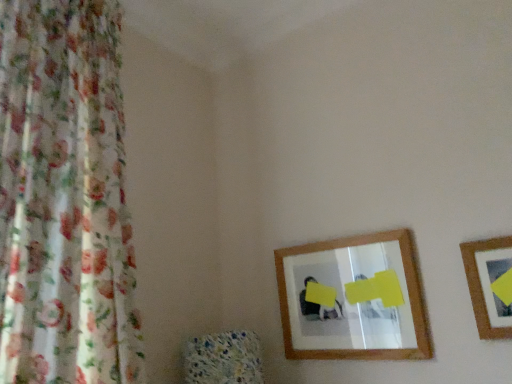
Locate an element on the screen. This screenshot has width=512, height=384. wooden-framed mirror at center is located at coordinates (347, 300).

Where is `picture frame above the wooden-framed mirror at center (from the image's perspective)`? picture frame above the wooden-framed mirror at center (from the image's perspective) is located at coordinates [490, 285].

Between wooden picture frame at right and wooden-framed mirror at center, which one has less height?

wooden picture frame at right is shorter.

Considering the sizes of objects wooden picture frame at right and wooden-framed mirror at center in the image provided, who is bigger, wooden picture frame at right or wooden-framed mirror at center?

With larger size is wooden-framed mirror at center.

Would you say wooden-framed mirror at center is part of floral fabric curtain at left's contents?

No, wooden-framed mirror at center is located outside of floral fabric curtain at left.

Locate an element on the screen. The height and width of the screenshot is (384, 512). mirror behind the floral fabric curtain at left is located at coordinates (347, 300).

Between floral fabric curtain at left and wooden-framed mirror at center, which one has larger width?

Wider between the two is floral fabric curtain at left.

Considering the relative positions of floral fabric curtain at left and wooden-framed mirror at center in the image provided, is floral fabric curtain at left to the left of wooden-framed mirror at center from the viewer's perspective?

Correct, you'll find floral fabric curtain at left to the left of wooden-framed mirror at center.

Considering the sizes of objects wooden-framed mirror at center and floral fabric curtain at left in the image provided, who is smaller, wooden-framed mirror at center or floral fabric curtain at left?

wooden-framed mirror at center is smaller.

From a real-world perspective, who is located lower, wooden-framed mirror at center or floral fabric curtain at left?

In real-world perspective, wooden-framed mirror at center is lower.

Considering the relative sizes of wooden-framed mirror at center and floral fabric curtain at left in the image provided, is wooden-framed mirror at center taller than floral fabric curtain at left?

In fact, wooden-framed mirror at center may be shorter than floral fabric curtain at left.

Is wooden-framed mirror at center aimed at floral fabric curtain at left?

Yes, wooden-framed mirror at center is aimed at floral fabric curtain at left.

Is wooden picture frame at right positioned far away from floral fabric curtain at left?

wooden picture frame at right is positioned a significant distance from floral fabric curtain at left.

Does point (489, 249) come farther from viewer compared to point (78, 85)?

No, it is in front of (78, 85).

Where is `curtain above the wooden picture frame at right (from the image's perspective)`? Image resolution: width=512 pixels, height=384 pixels. curtain above the wooden picture frame at right (from the image's perspective) is located at coordinates (64, 198).

From a real-world perspective, is wooden-framed mirror at center positioned under wooden picture frame at right based on gravity?

No, from a real-world perspective, wooden-framed mirror at center is not under wooden picture frame at right.

Is wooden-framed mirror at center at the right side of wooden picture frame at right?

No.

Considering the relative sizes of floral fabric curtain at left and wooden picture frame at right in the image provided, is floral fabric curtain at left smaller than wooden picture frame at right?

Incorrect, floral fabric curtain at left is not smaller in size than wooden picture frame at right.

Considering the relative positions of floral fabric curtain at left and wooden picture frame at right in the image provided, is floral fabric curtain at left behind wooden picture frame at right?

No, floral fabric curtain at left is in front of wooden picture frame at right.

Can wooden picture frame at right be found inside floral fabric curtain at left?

Definitely not — wooden picture frame at right is not inside floral fabric curtain at left.

You are a GUI agent. You are given a task and a screenshot of the screen. Output one action in this format:
    pyautogui.click(x=<x>, y=<y>)
    Task: Click on the curtain that is on the left side of wooden picture frame at right
    The width and height of the screenshot is (512, 384).
    Given the screenshot: What is the action you would take?
    pyautogui.click(x=64, y=198)

Locate an element on the screen. picture frame in front of the wooden-framed mirror at center is located at coordinates (490, 285).

Where is `mirror behind the floral fabric curtain at left`? Image resolution: width=512 pixels, height=384 pixels. mirror behind the floral fabric curtain at left is located at coordinates (347, 300).

Estimate the real-world distances between objects in this image. Which object is closer to floral fabric curtain at left, wooden-framed mirror at center or wooden picture frame at right?

wooden-framed mirror at center.

Consider the image. Based on their spatial positions, is wooden picture frame at right or floral fabric curtain at left closer to wooden-framed mirror at center?

wooden picture frame at right is positioned closer to the anchor wooden-framed mirror at center.

Which object lies further to the anchor point wooden-framed mirror at center, floral fabric curtain at left or wooden picture frame at right?

Among the two, floral fabric curtain at left is located further to wooden-framed mirror at center.

In the scene shown: Looking at the image, which one is located closer to wooden picture frame at right, wooden-framed mirror at center or floral fabric curtain at left?

Among the two, wooden-framed mirror at center is located nearer to wooden picture frame at right.

Considering their positions, is floral fabric curtain at left positioned closer to wooden picture frame at right than wooden-framed mirror at center?

Among the two, wooden-framed mirror at center is located nearer to wooden picture frame at right.

When comparing their distances from floral fabric curtain at left, does wooden picture frame at right or wooden-framed mirror at center seem further?

wooden picture frame at right lies further to floral fabric curtain at left than the other object.

Where is `mirror between floral fabric curtain at left and wooden picture frame at right`? This screenshot has width=512, height=384. mirror between floral fabric curtain at left and wooden picture frame at right is located at coordinates (347, 300).